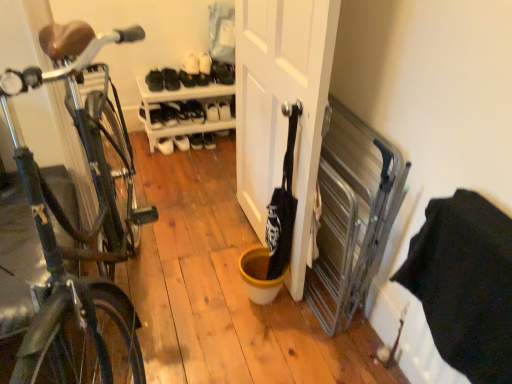
Identify the location of free space in front of yellow matte bucket at center. (253, 327).